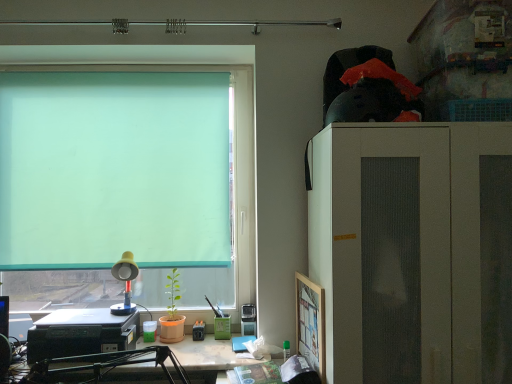
I want to click on free point above black plastic printer at lower left (from a real-world perspective), so click(x=89, y=313).